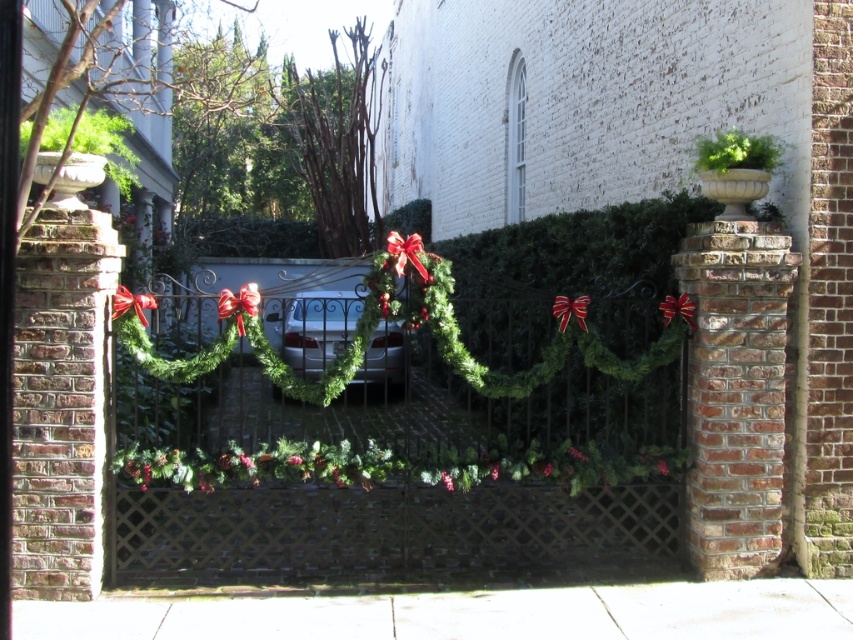
Between green garland at center and shiny silver car at center, which one is positioned higher?

Positioned higher is shiny silver car at center.

Between green garland at center and shiny silver car at center, which one has more height?

green garland at center

Locate an element on the screen. The image size is (853, 640). green garland at center is located at coordinates [380, 508].